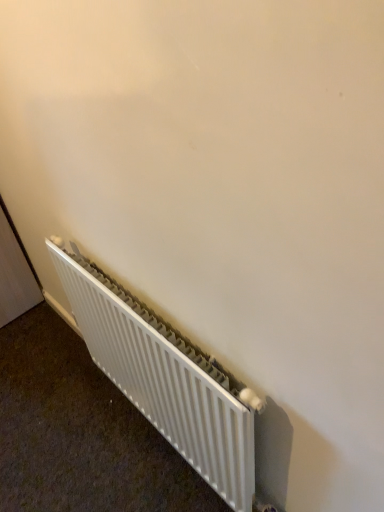
Identify the location of white matte radiator at lower left. The image size is (384, 512). (164, 380).

What do you see at coordinates (164, 380) in the screenshot? I see `white matte radiator at lower left` at bounding box center [164, 380].

This screenshot has width=384, height=512. Find the location of `white matte radiator at lower left`. white matte radiator at lower left is located at coordinates (164, 380).